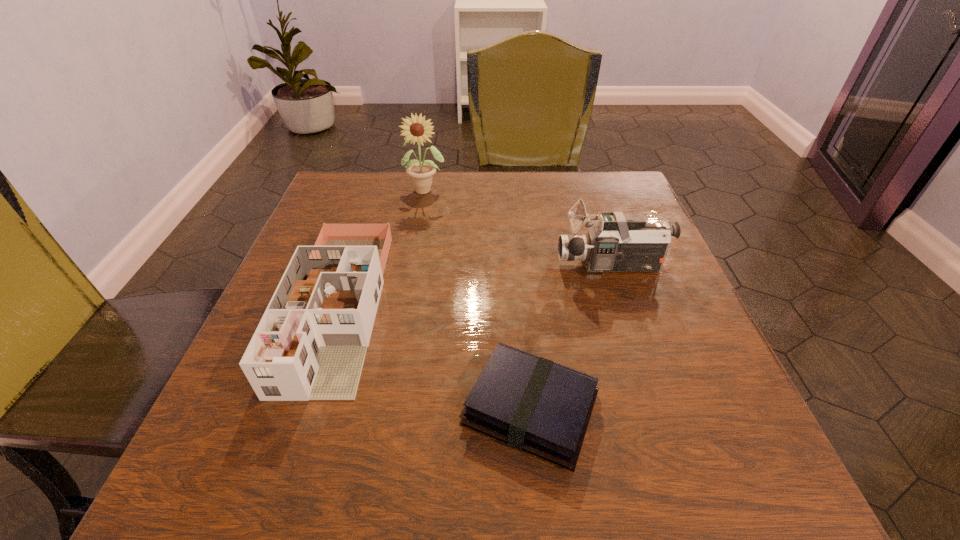
You are a GUI agent. You are given a task and a screenshot of the screen. Output one action in this format:
    pyautogui.click(x=<x>, y=<y>)
    Task: Click on the free space between the dollhouse and the camcorder
    
    Given the screenshot: What is the action you would take?
    pyautogui.click(x=475, y=286)

Locate which object ranks in proximity to the sunflower. Please provide its 2D coordinates. Your answer should be formatted as a tuple, i.e. [(x, y)], where the tuple contains the x and y coordinates of a point satisfying the conditions above.

[(311, 342)]

Point out which object is positioned as the third nearest to the shortest object. Please provide its 2D coordinates. Your answer should be formatted as a tuple, i.e. [(x, y)], where the tuple contains the x and y coordinates of a point satisfying the conditions above.

[(421, 173)]

I want to click on vacant space that satisfies the following two spatial constraints: 1. on the front-facing side of the shortest object; 2. on the left side of the farthest object, so click(388, 408).

Identify the location of free location that satisfies the following two spatial constraints: 1. at the entrance of the dollhouse; 2. on the left side of the book. (305, 408).

Locate an element on the screen. This screenshot has width=960, height=540. vacant space that satisfies the following two spatial constraints: 1. on the front-facing side of the second tallest object; 2. at the entrance of the third tallest object is located at coordinates (626, 306).

This screenshot has height=540, width=960. I want to click on free spot that satisfies the following two spatial constraints: 1. at the entrance of the book; 2. on the left side of the second shortest object, so click(x=305, y=408).

Identify the location of vacant space that satisfies the following two spatial constraints: 1. on the front-facing side of the second tallest object; 2. at the entrance of the third tallest object. This screenshot has width=960, height=540. (626, 306).

Where is `blank space that satisfies the following two spatial constraints: 1. at the entrance of the dollhouse; 2. on the left side of the shortest object`? This screenshot has width=960, height=540. blank space that satisfies the following two spatial constraints: 1. at the entrance of the dollhouse; 2. on the left side of the shortest object is located at coordinates (305, 408).